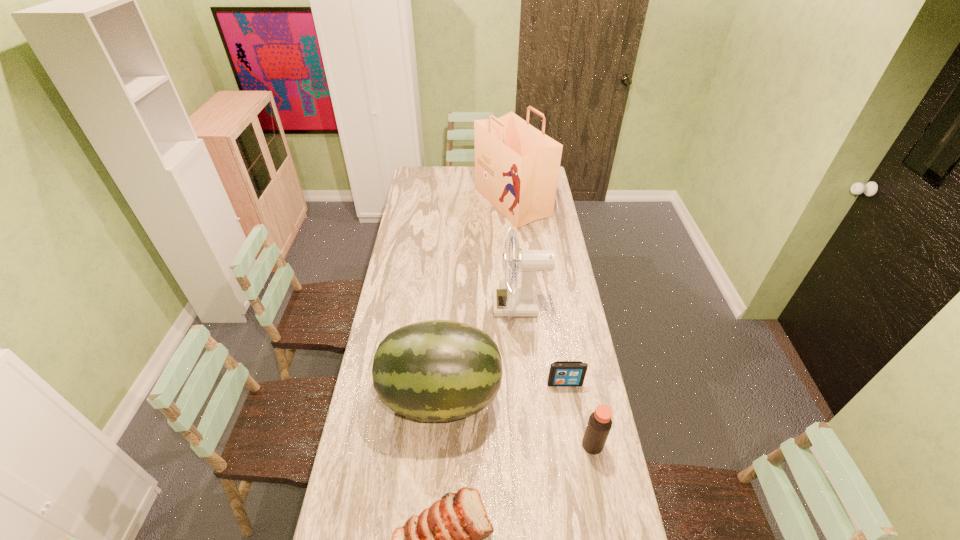
You are a GUI agent. You are given a task and a screenshot of the screen. Output one action in this format:
    pyautogui.click(x=<x>, y=<y>)
    Task: Click on the vinegar that is at the right edge
    This screenshot has width=960, height=540.
    Given the screenshot: What is the action you would take?
    pyautogui.click(x=599, y=425)

Identify the location of iPod positioned at the right edge. The width and height of the screenshot is (960, 540). (562, 373).

Where is `object at the far right corner`? object at the far right corner is located at coordinates (517, 166).

This screenshot has width=960, height=540. In order to click on free space at the far edge of the desktop in this screenshot , I will do `click(448, 169)`.

The width and height of the screenshot is (960, 540). I want to click on vacant space at the left edge of the desktop, so click(392, 287).

Find the location of a particular element. Image resolution: width=960 pixels, height=540 pixels. free space at the right edge is located at coordinates (570, 285).

Find the location of a particular element. free region at the far left corner is located at coordinates (434, 174).

At what (x,y) coordinates should I click in order to perform the action: click on free point between the third tallest object and the grocery bag. Please return your answer as a coordinate pair (x, y). The height and width of the screenshot is (540, 960). Looking at the image, I should click on (476, 300).

Locate an element on the screen. free space between the iPod and the farthest object is located at coordinates (539, 293).

Image resolution: width=960 pixels, height=540 pixels. Find the location of `vacant area that lies between the iPod and the watermelon`. vacant area that lies between the iPod and the watermelon is located at coordinates (503, 390).